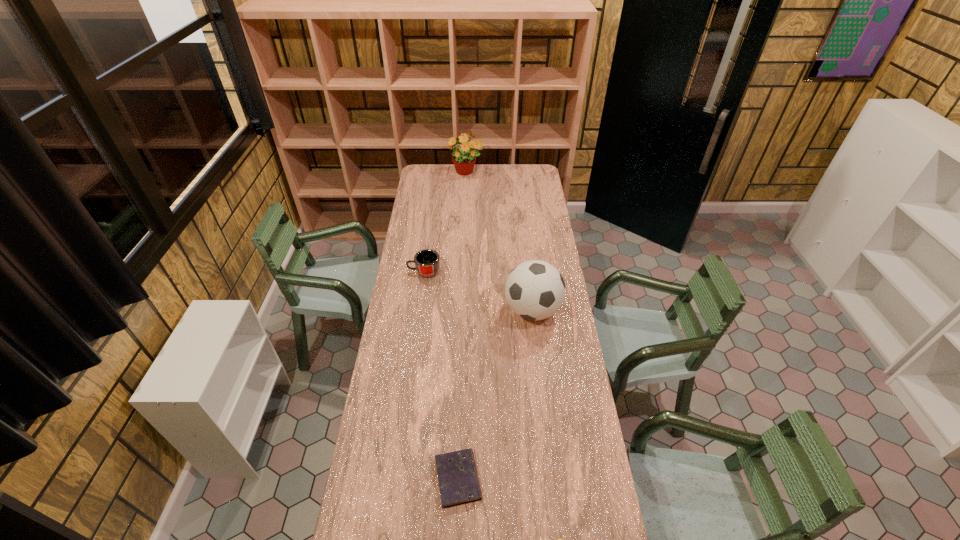
You are a GUI agent. You are given a task and a screenshot of the screen. Output one action in this format:
    pyautogui.click(x=<x>, y=<y>)
    Task: Click on the flowerpot
    
    Given the screenshot: What is the action you would take?
    pyautogui.click(x=464, y=160)

This screenshot has width=960, height=540. Find the location of `soccer ball`. soccer ball is located at coordinates (535, 290).

Identify the location of the third tallest object. (427, 261).

Find the location of `mug`. mug is located at coordinates (427, 261).

The image size is (960, 540). In order to click on diary in this screenshot , I will do `click(458, 480)`.

Identify the location of the shortest object. The height and width of the screenshot is (540, 960). (458, 480).

At what (x,y) coordinates should I click in order to perform the action: click on vacant space located 0.310m on the right of the flowerpot. Please return your answer as a coordinate pair (x, y). The height and width of the screenshot is (540, 960). Looking at the image, I should click on (532, 173).

The image size is (960, 540). I want to click on vacant point located 0.400m on the front of the soccer ball, so click(545, 418).

What are the coordinates of `vacant area situated on the right of the diary` in the screenshot? It's located at (585, 478).

The width and height of the screenshot is (960, 540). What are the coordinates of `object that is positioned at the far edge` in the screenshot? It's located at (464, 160).